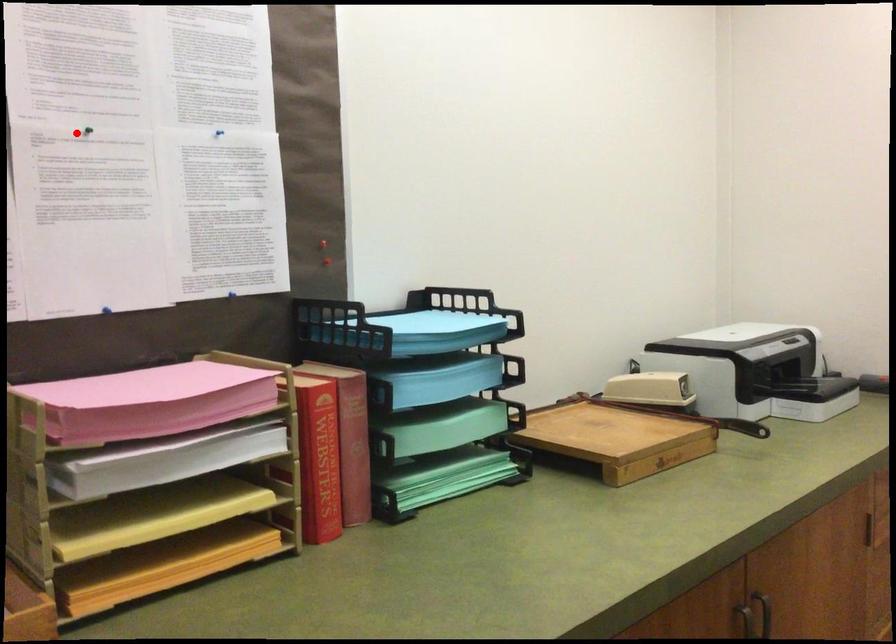
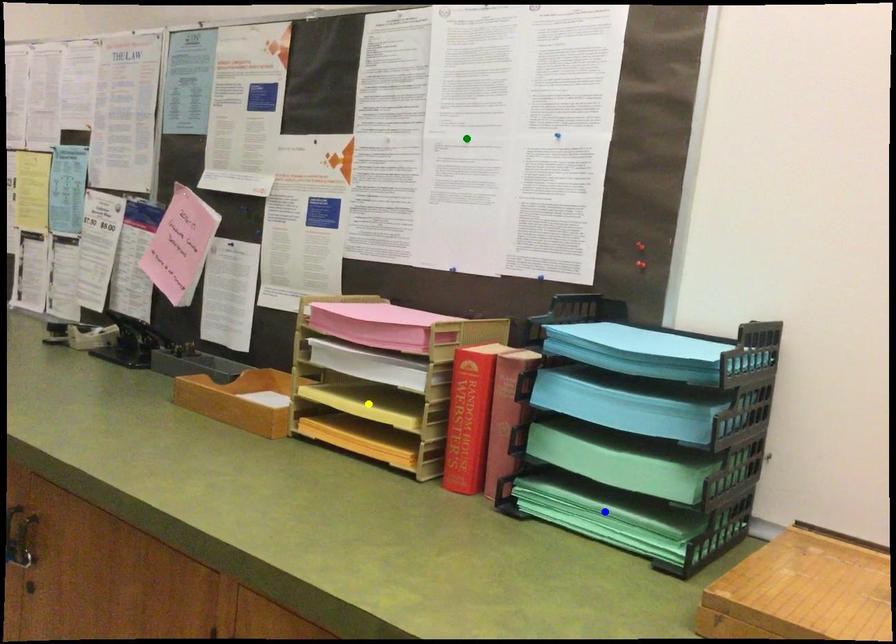
Question: I am providing you with two images of the same scene from different viewpoints. A red point is marked on the first image. You are given multiple points on the second image. In image 2, which mark is for the same physical point as the one in image 1?

Choices:
 (A) yellow point
 (B) blue point
 (C) green point

Answer: (C)